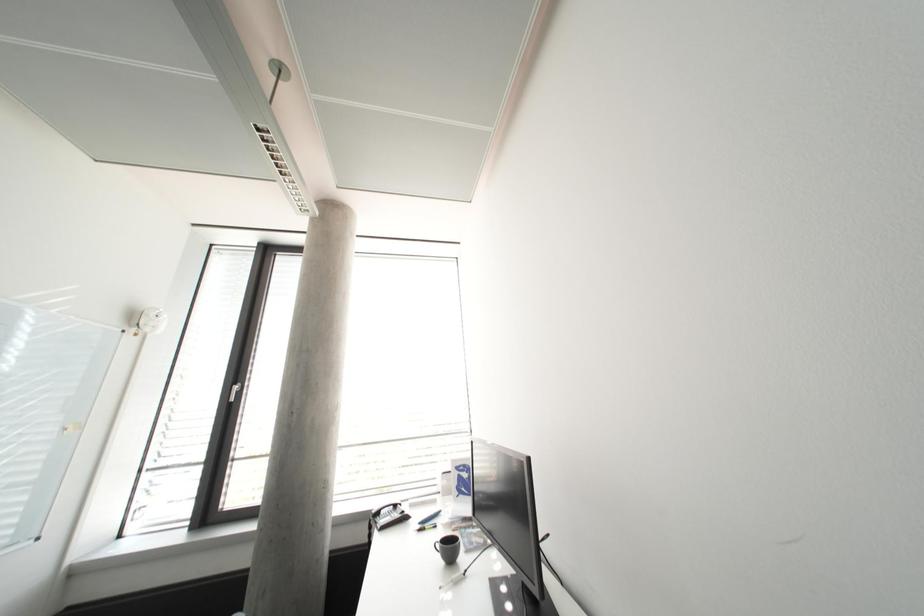
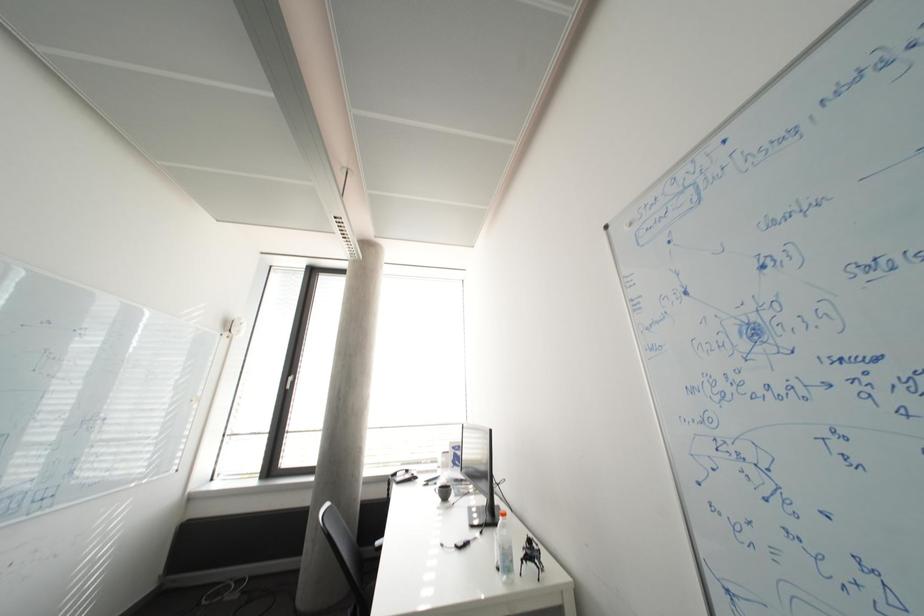
Question: What movement of the cameraman would produce the second image?

Choices:
 (A) Left
 (B) Right
 (C) Forward
 (D) Backward

Answer: (D)